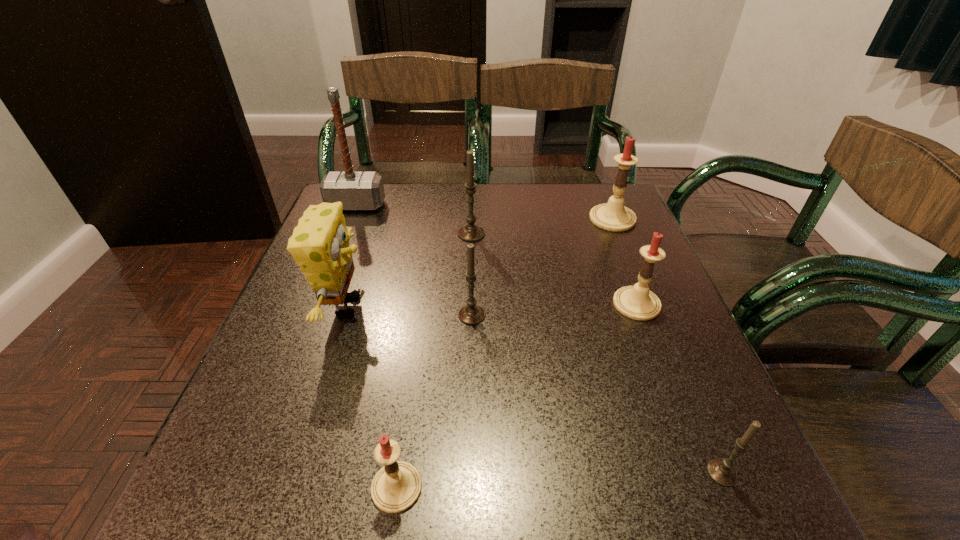
You are a GUI agent. You are given a task and a screenshot of the screen. Output one action in this format:
    pyautogui.click(x=<x>, y=<y>)
    Task: Click on the hammer present at the left edge
    
    Given the screenshot: What is the action you would take?
    pyautogui.click(x=355, y=190)

At what (x,y) coordinates should I click in order to perform the action: click on sponge that is at the left edge. Please return your answer as a coordinate pair (x, y). The image size is (960, 540). Looking at the image, I should click on (320, 244).

You are a GUI agent. You are given a task and a screenshot of the screen. Output one action in this format:
    pyautogui.click(x=<x>, y=<y>)
    Task: Click on the object at the far left corner
    Image resolution: width=960 pixels, height=540 pixels.
    Given the screenshot: What is the action you would take?
    pyautogui.click(x=355, y=190)

The image size is (960, 540). In order to click on object present at the far right corner in this screenshot , I will do `click(613, 216)`.

This screenshot has width=960, height=540. What are the coordinates of `object that is at the near right corner` in the screenshot? It's located at (721, 471).

Find the location of a particular element. This screenshot has height=540, width=960. vacant space at the far edge of the desktop is located at coordinates (533, 210).

In the image, there is a desktop. Where is `vacant space at the near edge`? vacant space at the near edge is located at coordinates (401, 519).

Identify the location of free space at the left edge. The image size is (960, 540). (362, 293).

The height and width of the screenshot is (540, 960). In order to click on vacant region at the right edge of the desktop in this screenshot , I will do `click(601, 286)`.

I want to click on free space at the far left corner of the desktop, so click(x=380, y=219).